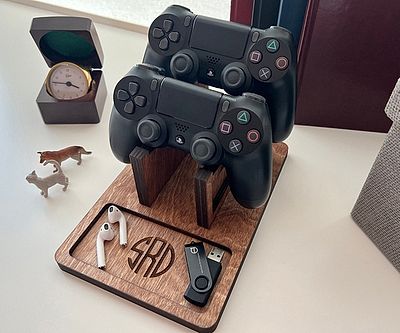
This screenshot has width=400, height=333. What are the coordinates of `black watch box` in the screenshot? It's located at (75, 48).